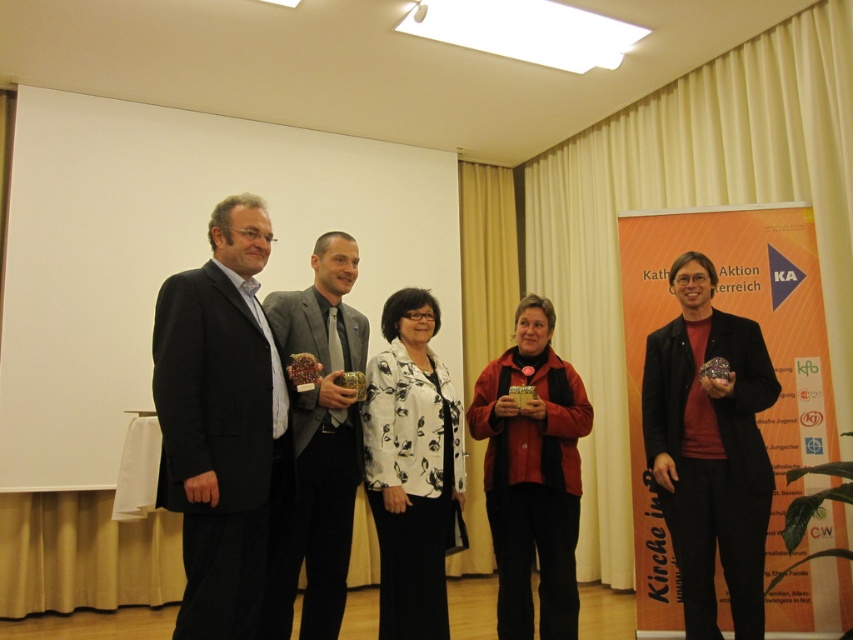
Question: Based on their relative distances, which object is nearer to the black matte suit at left?

Choices:
 (A) white floral fabric at center
 (B) matte red jacket at center
 (C) matte black dress at center

Answer: (A)

Question: Estimate the real-world distances between objects in this image. Which object is farther from the matte red jacket at center?

Choices:
 (A) matte gray suit at center
 (B) white floral fabric at center

Answer: (A)

Question: Where is black matte suit at left located in relation to matte red jacket at center in the image?

Choices:
 (A) below
 (B) above

Answer: (B)

Question: In this image, where is matte red jacket at center located relative to matte gray suit at center?

Choices:
 (A) below
 (B) above

Answer: (A)

Question: Does matte gray suit at center appear on the left side of white floral fabric at center?

Choices:
 (A) no
 (B) yes

Answer: (B)

Question: Which of the following is the farthest from the observer?

Choices:
 (A) matte gray suit at center
 (B) white floral fabric at center
 (C) matte black dress at center
 (D) black matte suit at left

Answer: (C)